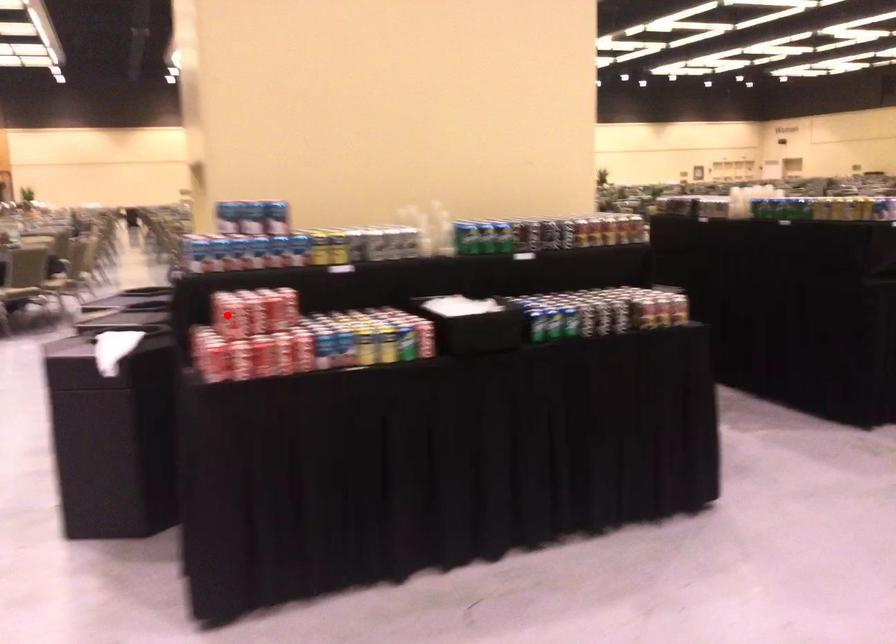
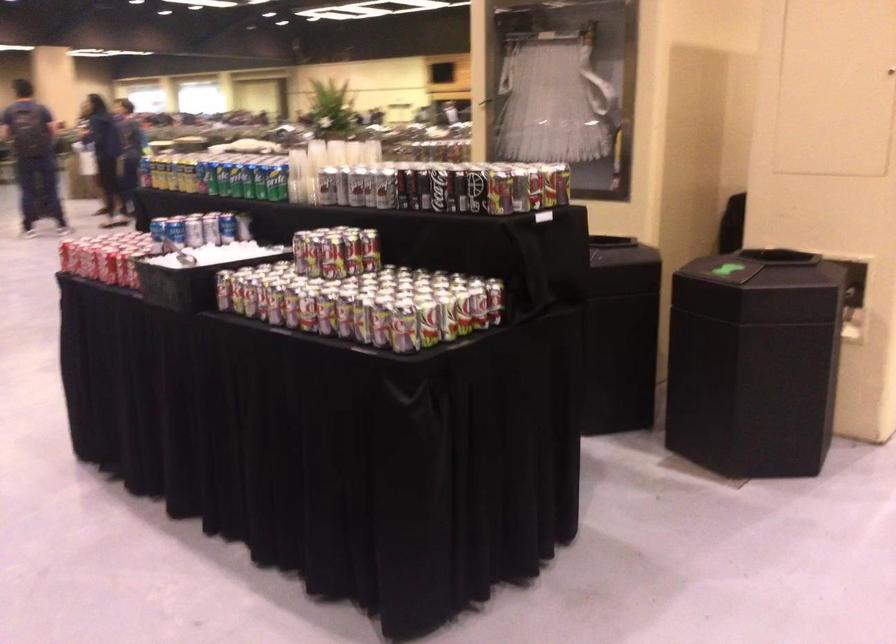
Question: I am providing you with two images of the same scene from different viewpoints. A red point is marked on the first image. At the location where the point appears in image 1, is it still visible in image 2?

Choices:
 (A) Yes
 (B) No

Answer: (B)